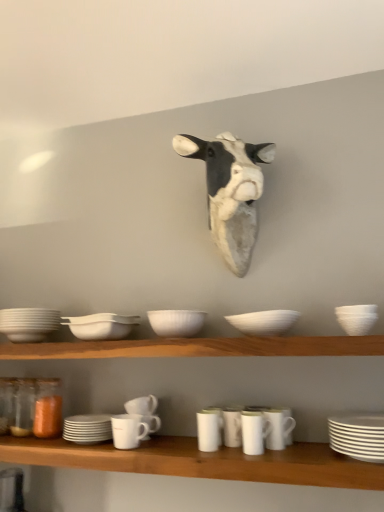
Locate an element on the screen. Image resolution: width=384 pixels, height=512 pixels. vacant area that lies to the right of white matte mug at lower center, the sixth tableware from the right is located at coordinates (176, 438).